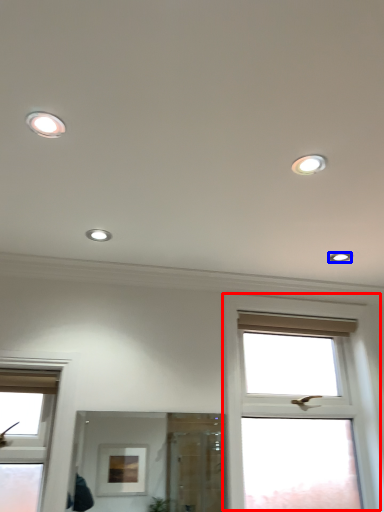
Question: Which object appears farthest to the camera in this image, window (highlighted by a red box) or dot (highlighted by a blue box)?

Choices:
 (A) window
 (B) dot

Answer: (B)